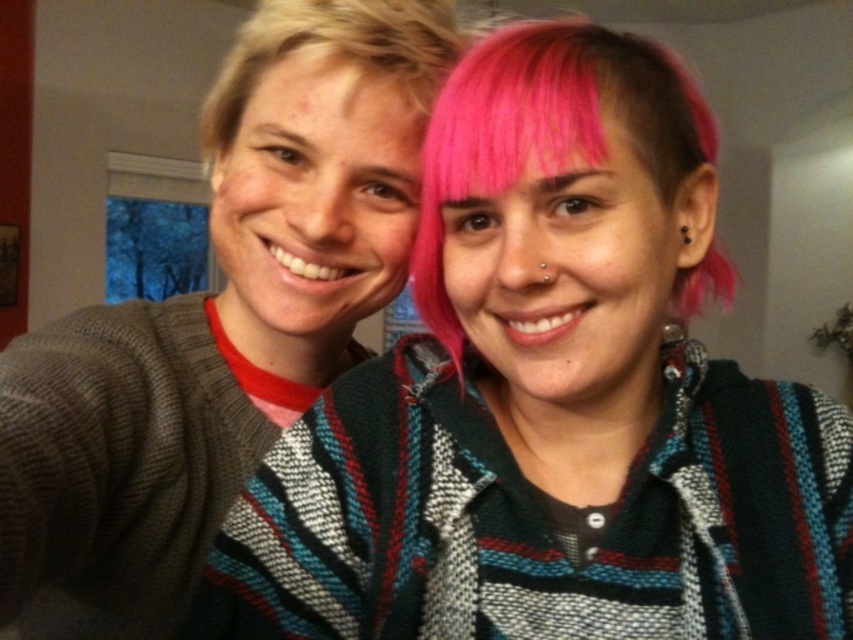
Question: Is pink knitted sweater at center closer to the viewer compared to pink dyed hair at center?

Choices:
 (A) yes
 (B) no

Answer: (A)

Question: Is pink knitted sweater at center wider than knitted sweater at center?

Choices:
 (A) yes
 (B) no

Answer: (A)

Question: Which point appears closest to the camera in this image?

Choices:
 (A) (389, 33)
 (B) (294, 202)
 (C) (595, 65)
 (D) (428, 129)

Answer: (C)

Question: Which point is closer to the camera taking this photo?

Choices:
 (A) (425, 92)
 (B) (231, 77)
 (C) (456, 125)

Answer: (C)

Question: Which point is closer to the camera taking this photo?

Choices:
 (A) (508, 84)
 (B) (592, 470)
 (C) (276, 154)

Answer: (A)

Question: Observing the image, what is the correct spatial positioning of knitted sweater at center in reference to pink dyed hair at center?

Choices:
 (A) right
 (B) left

Answer: (B)